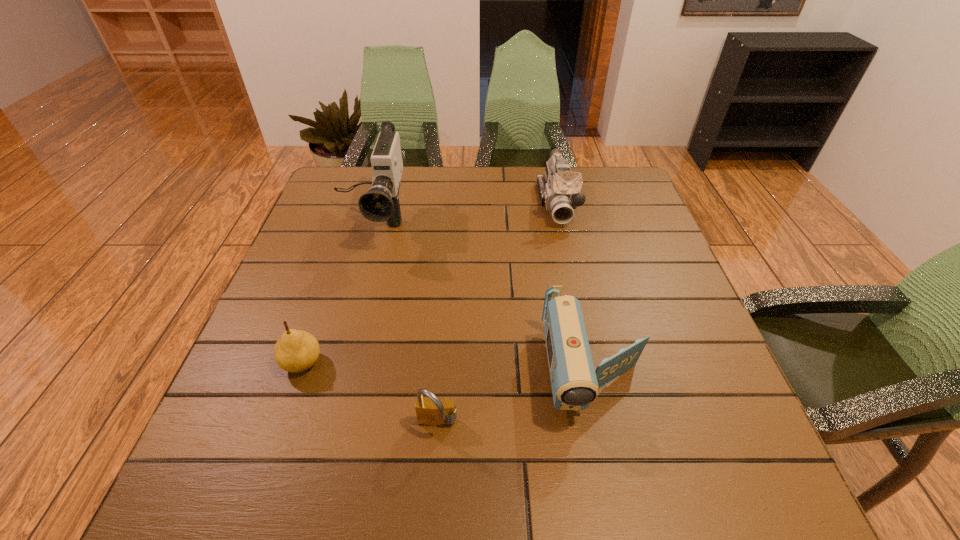
Find the location of a particular element. This screenshot has height=540, width=960. empty space that is in between the pear and the padlock is located at coordinates (370, 394).

This screenshot has width=960, height=540. In order to click on vacant space in between the pear and the padlock in this screenshot , I will do tap(370, 394).

Locate an element on the screen. empty location between the shortest camcorder and the leftmost camcorder is located at coordinates (482, 298).

Locate which object ranks second in proximity to the tallest camcorder. Please provide its 2D coordinates. Your answer should be formatted as a tuple, i.e. [(x, y)], where the tuple contains the x and y coordinates of a point satisfying the conditions above.

[(559, 190)]

Identify the location of object that can be found as the closest to the pear. (431, 412).

You are a GUI agent. You are given a task and a screenshot of the screen. Output one action in this format:
    pyautogui.click(x=<x>, y=<y>)
    Task: Click on the camcorder that is the second nearest to the pear
    
    Given the screenshot: What is the action you would take?
    pyautogui.click(x=575, y=383)

This screenshot has width=960, height=540. I want to click on camcorder that is the closest to the shortest camcorder, so click(x=559, y=190).